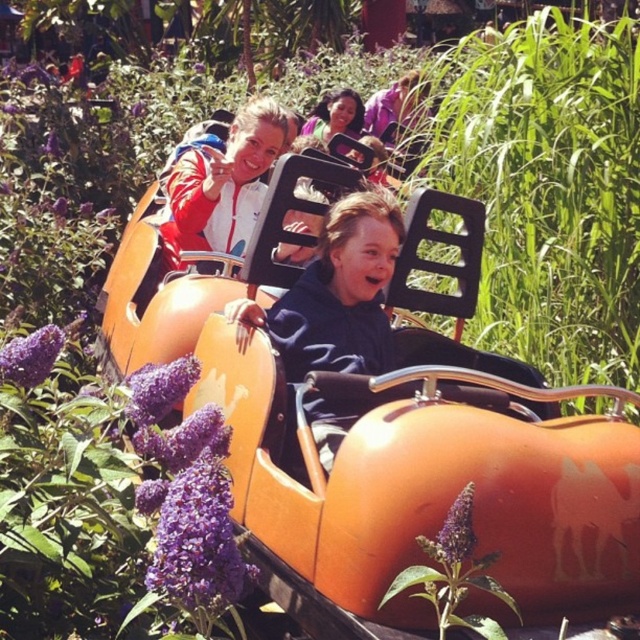
Describe the element at coordinates (221, 184) in the screenshot. The height and width of the screenshot is (640, 640). I see `matte red jacket at upper center` at that location.

Is matte red jacket at upper center above smooth skin girl at center?

No, matte red jacket at upper center is not above smooth skin girl at center.

Describe the element at coordinates (221, 184) in the screenshot. The image size is (640, 640). I see `matte red jacket at upper center` at that location.

Find the location of a particular element. matte red jacket at upper center is located at coordinates (221, 184).